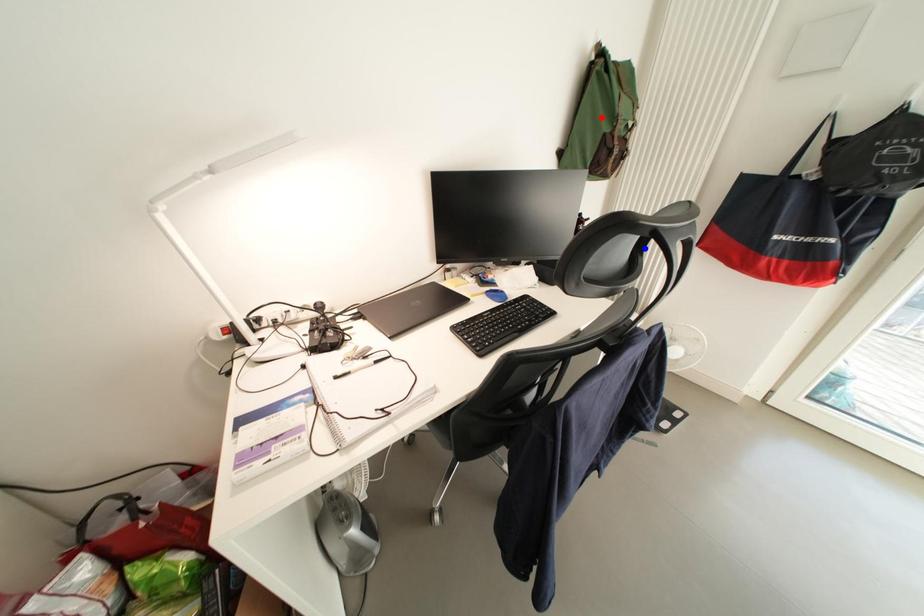
Question: Two points are marked on the image. Which point is closer to the camera?

Choices:
 (A) Blue point is closer.
 (B) Red point is closer.

Answer: (A)